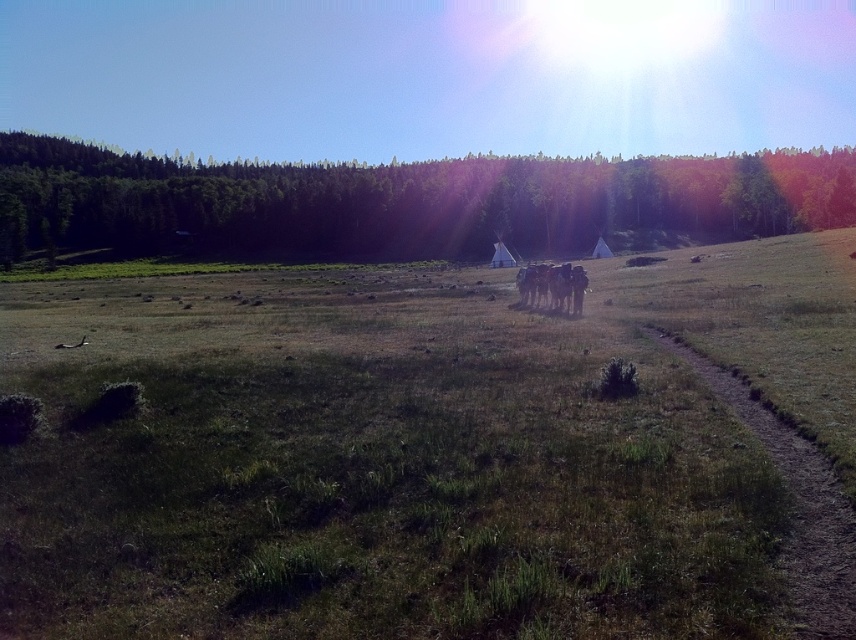
The image size is (856, 640). What do you see at coordinates (403, 202) in the screenshot?
I see `green leafy tree at upper center` at bounding box center [403, 202].

The width and height of the screenshot is (856, 640). Identify the location of green leafy tree at upper center. (403, 202).